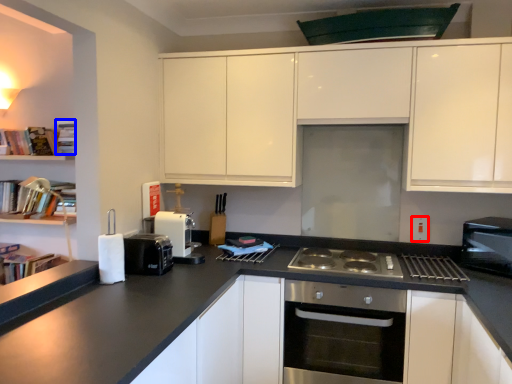
Question: Which point is closer to the camera, electric outlet (highlighted by a red box) or book (highlighted by a blue box)?

Choices:
 (A) electric outlet
 (B) book

Answer: (A)